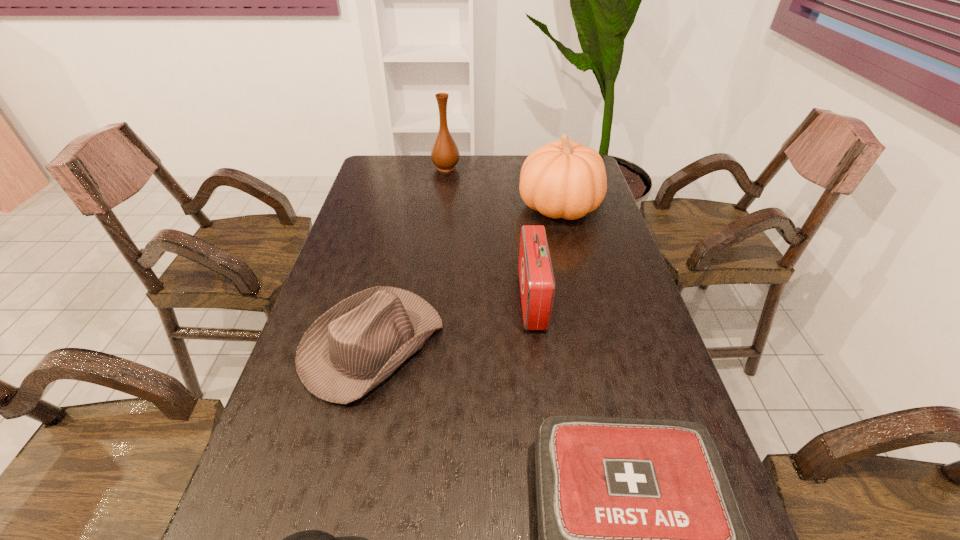
Identify the location of free space located 0.210m on the front of the fedora. (334, 513).

Where is `vase that is at the far edge`? The height and width of the screenshot is (540, 960). vase that is at the far edge is located at coordinates (445, 155).

Locate an element on the screen. The width and height of the screenshot is (960, 540). pumpkin present at the far edge is located at coordinates coord(564,179).

At what (x,y) coordinates should I click in order to perform the action: click on object at the left edge. Please return your answer as a coordinate pair (x, y). The image size is (960, 540). Looking at the image, I should click on (357, 344).

The image size is (960, 540). Identify the location of object that is positioned at the right edge. (564, 179).

I want to click on object present at the far right corner, so click(x=564, y=179).

Identify the location of free space at the far edge of the desktop. (445, 176).

This screenshot has width=960, height=540. Identify the location of vacant space at the left edge. (320, 300).

In the image, there is a desktop. Where is `free space at the right edge`? Image resolution: width=960 pixels, height=540 pixels. free space at the right edge is located at coordinates (574, 272).

Identify the location of vacant space at the far left corner of the desktop. This screenshot has height=540, width=960. (406, 183).